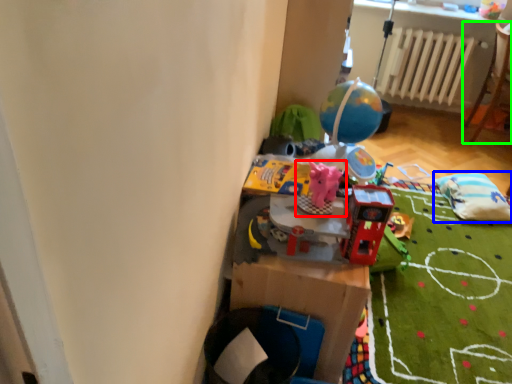
Question: Estimate the real-world distances between objects in this image. Which object is farther from toy (highlighted by a red box), bean bag chair (highlighted by a blue box) or furniture (highlighted by a green box)?

Choices:
 (A) bean bag chair
 (B) furniture

Answer: (B)